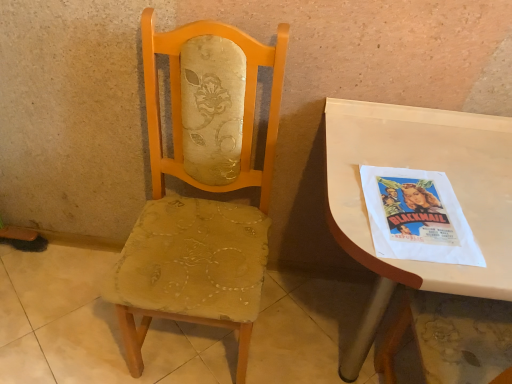
Where is `free space to the back side of white paper poster at right`? The width and height of the screenshot is (512, 384). free space to the back side of white paper poster at right is located at coordinates (399, 152).